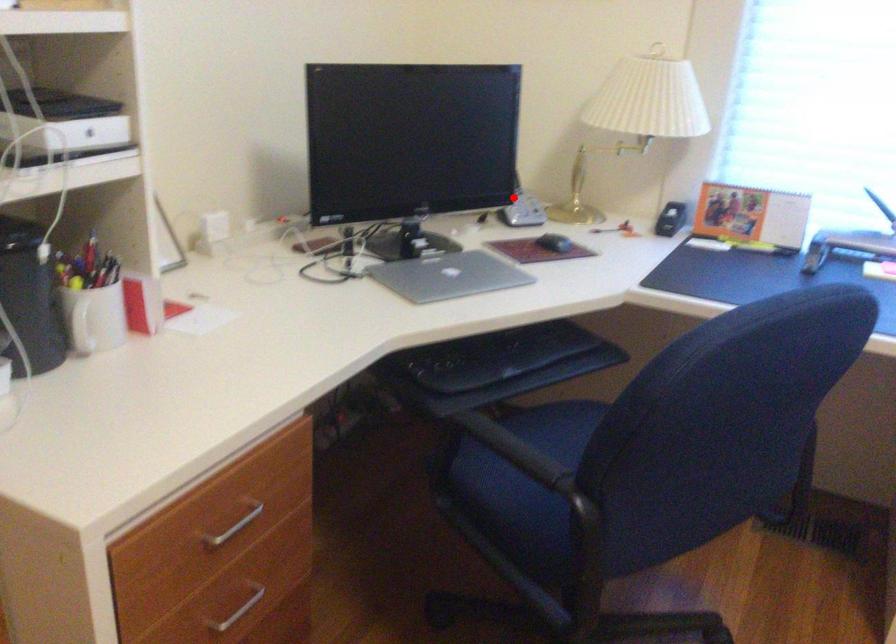
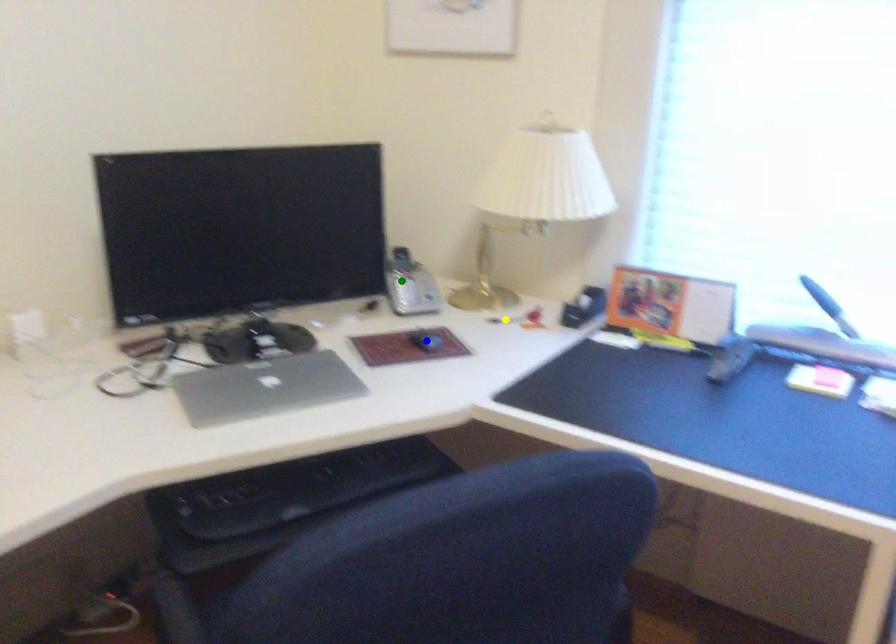
Question: I am providing you with two images of the same scene from different viewpoints. A red point is marked on the first image. You are given multiple points on the second image. Which point in image 2 is actually the same real-world point as the red point in image 1?

Choices:
 (A) green point
 (B) blue point
 (C) yellow point

Answer: (A)